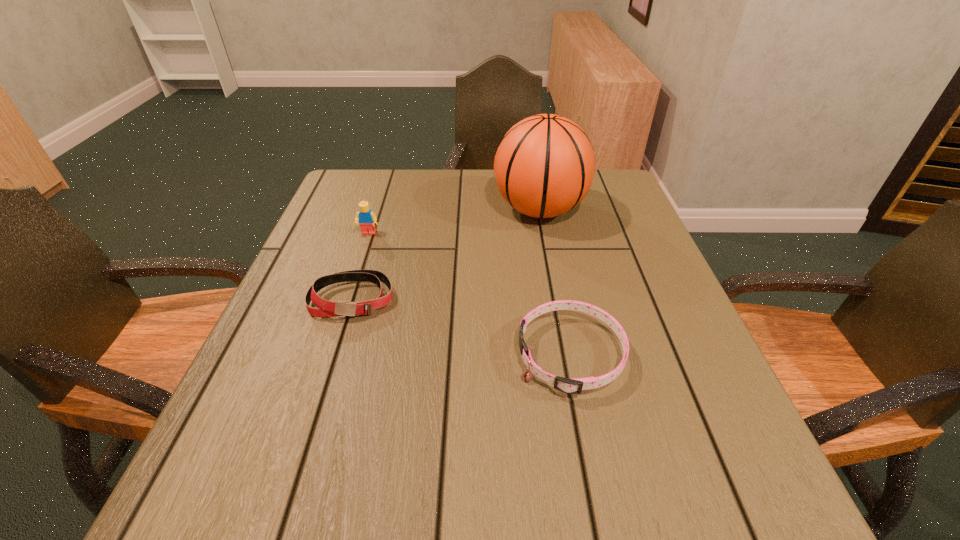
Find the location of `object that is at the far edge`. object that is at the far edge is located at coordinates (544, 166).

At what (x,y) coordinates should I click in order to perform the action: click on Lego that is at the left edge. Please return your answer as a coordinate pair (x, y). The image size is (960, 540). Looking at the image, I should click on (366, 218).

Identify the location of dog collar at the left edge. (325, 308).

Locate an element on the screen. The height and width of the screenshot is (540, 960). basketball at the right edge is located at coordinates [544, 166].

Image resolution: width=960 pixels, height=540 pixels. I want to click on dog collar that is at the right edge, so click(575, 385).

Find the location of a particular element. The width and height of the screenshot is (960, 540). object positioned at the far right corner is located at coordinates (544, 166).

The width and height of the screenshot is (960, 540). In the image, there is a desktop. Identify the location of free space at the far edge. (418, 174).

What are the coordinates of `vacant region at the left edge of the desktop` in the screenshot? It's located at (310, 448).

In the image, there is a desktop. Identify the location of free space at the far left corner. (359, 200).

Find the location of a particular element. vacant space at the near left corner of the desktop is located at coordinates (293, 502).